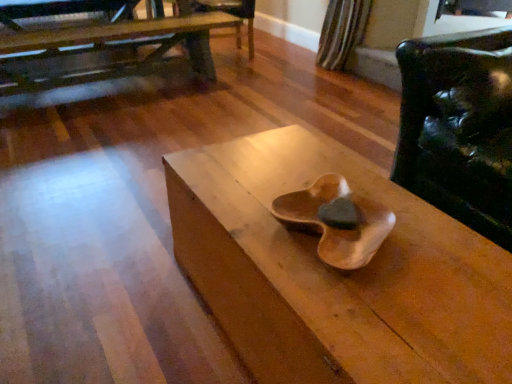
Identify the location of vacant space to the right of wooden armchair at center. The height and width of the screenshot is (384, 512). (285, 61).